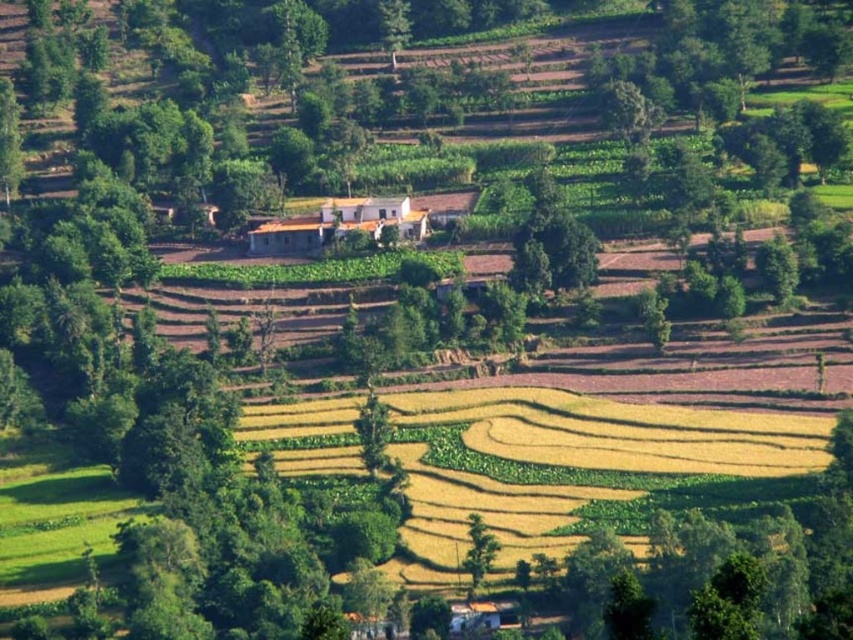
Question: Does green leafy tree at center have a greater width compared to green leafy tree at lower center?

Choices:
 (A) no
 (B) yes

Answer: (B)

Question: Which point appears closest to the camera in this image?

Choices:
 (A) (474, 524)
 (B) (405, 396)
 (C) (358, 433)

Answer: (A)

Question: Among these objects, which one is nearest to the camera?

Choices:
 (A) green leafy tree at lower center
 (B) yellow-green grassland at center
 (C) green leafy tree at center

Answer: (A)

Question: Does green leafy tree at center have a greater width compared to green leafy tree at lower center?

Choices:
 (A) yes
 (B) no

Answer: (A)

Question: Estimate the real-world distances between objects in this image. Which object is closer to the green leafy tree at center?

Choices:
 (A) yellow-green grassland at center
 (B) green leafy tree at lower center

Answer: (A)

Question: Considering the relative positions of yellow-green grassland at center and green leafy tree at center in the image provided, where is yellow-green grassland at center located with respect to green leafy tree at center?

Choices:
 (A) left
 (B) right

Answer: (B)